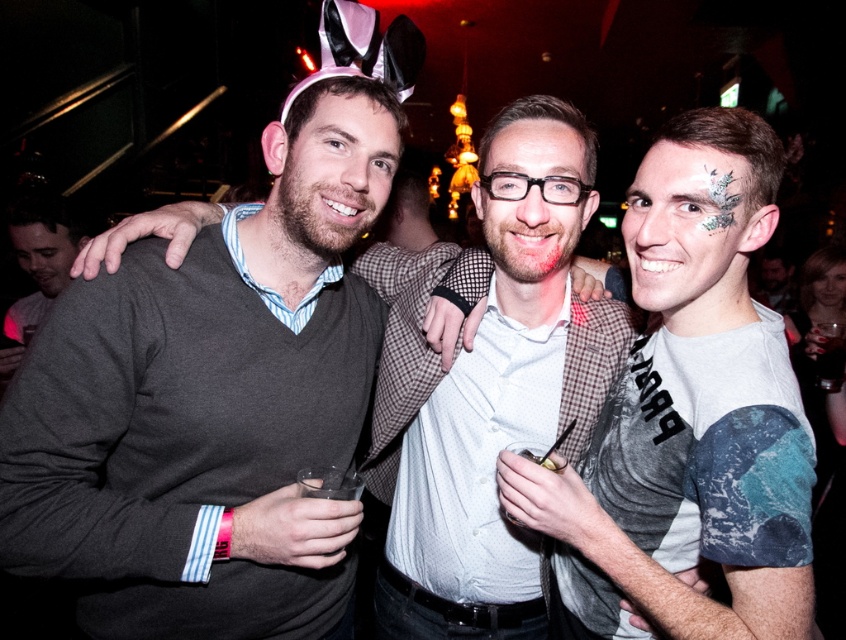
Based on the scene description, which object is positioned lower in the image between the white textured shirt at center and the matte gray sweater at center?

The white textured shirt at center is located below the matte gray sweater at center, so it is positioned lower in the image.

You are a photographer at the event and need to adjust the lighting so that both the white textured shirt at center and the matte gray sweater at center are equally illuminated. Given their current positions, what should you consider about their distance apart?

The white textured shirt at center and the matte gray sweater at center are 1.75 meters apart from each other. To equally illuminate both, the photographer should ensure the lighting setup accounts for this distance so that neither is too close or too far from the light source.

You are a photographer adjusting your camera settings to capture the best shot. You notice two points in the image at coordinates point (586, 552) and point (37, 230). Which point should you focus on to ensure it appears sharp in the final photo?

Point (586, 552) is closer to the camera than point (37, 230), so focusing on point (586, 552) will ensure it appears sharp in the photo.